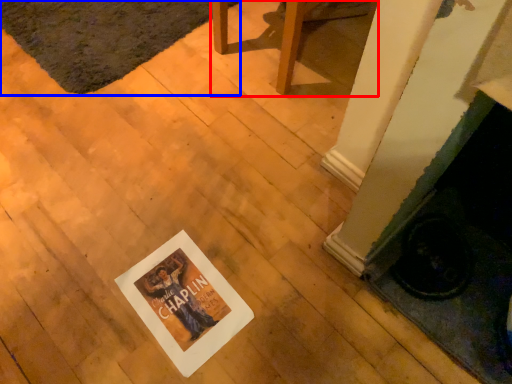
Question: Which object appears farthest to the camera in this image, furniture (highlighted by a red box) or mat (highlighted by a blue box)?

Choices:
 (A) furniture
 (B) mat

Answer: (B)